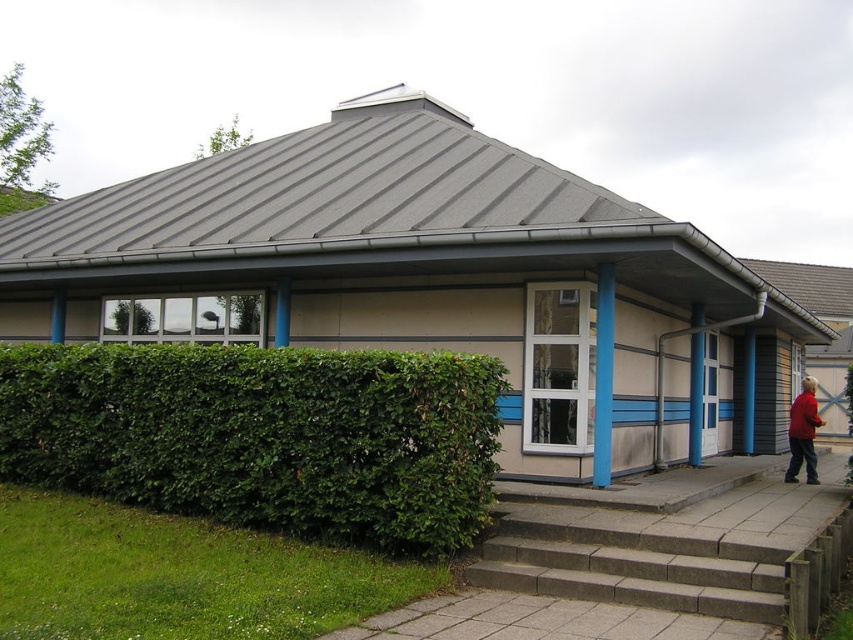
What do you see at coordinates (633, 568) in the screenshot? I see `gray concrete stairs at lower center` at bounding box center [633, 568].

Between gray concrete stairs at lower center and red fabric jacket at lower right, which one has more height?

gray concrete stairs at lower center is taller.

Describe the element at coordinates (633, 568) in the screenshot. The width and height of the screenshot is (853, 640). I see `gray concrete stairs at lower center` at that location.

The width and height of the screenshot is (853, 640). Identify the location of gray concrete stairs at lower center. (633, 568).

Who is higher up, green leafy hedge at lower left or red fabric jacket at lower right?

green leafy hedge at lower left is higher up.

Is green leafy hedge at lower left above red fabric jacket at lower right?

Yes.

The height and width of the screenshot is (640, 853). What do you see at coordinates (263, 436) in the screenshot?
I see `green leafy hedge at lower left` at bounding box center [263, 436].

The image size is (853, 640). Identify the location of green leafy hedge at lower left. (263, 436).

Is green leafy hedge at lower left taller than gray concrete stairs at lower center?

Yes.

Looking at this image, between green leafy hedge at lower left and gray concrete stairs at lower center, which one is positioned higher?

Positioned higher is green leafy hedge at lower left.

Between point (279, 508) and point (674, 577), which one is positioned in front?

Point (674, 577)

Image resolution: width=853 pixels, height=640 pixels. I want to click on green leafy hedge at lower left, so click(263, 436).